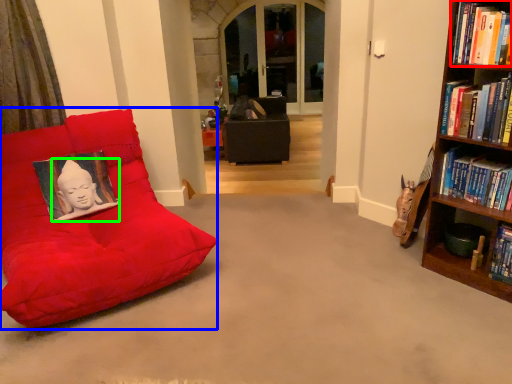
Question: Which object is the closest to the book (highlighted by a red box)? Choose among these: furniture (highlighted by a blue box) or person (highlighted by a green box).

Choices:
 (A) furniture
 (B) person

Answer: (A)